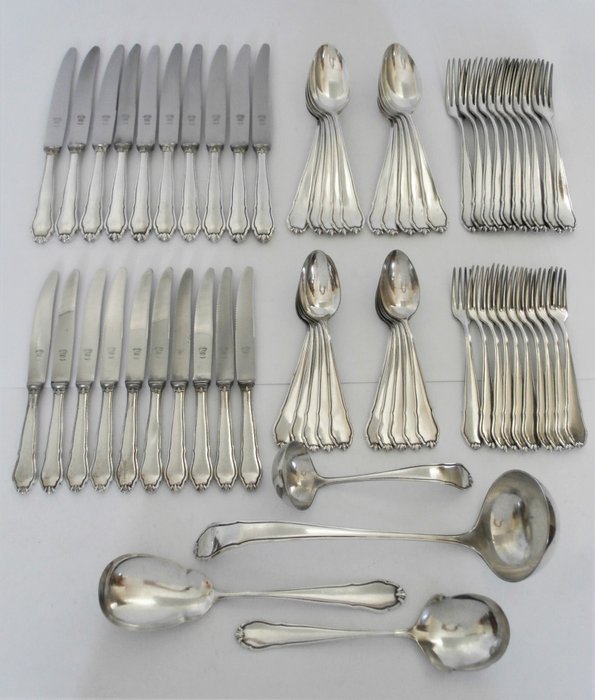
The height and width of the screenshot is (700, 595). I want to click on serving pieces, so click(x=305, y=477), click(x=502, y=516), click(x=140, y=578), click(x=468, y=648).